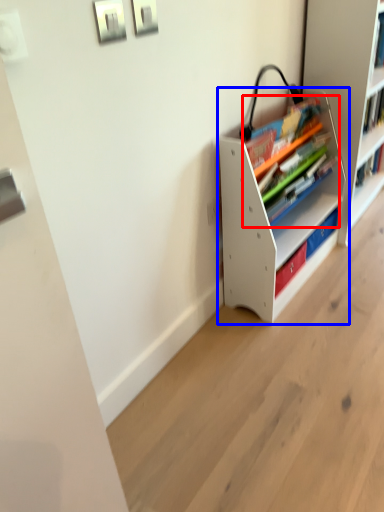
Question: Which of the following is the closest to the observer, book (highlighted by a red box) or shelf (highlighted by a blue box)?

Choices:
 (A) book
 (B) shelf

Answer: (B)